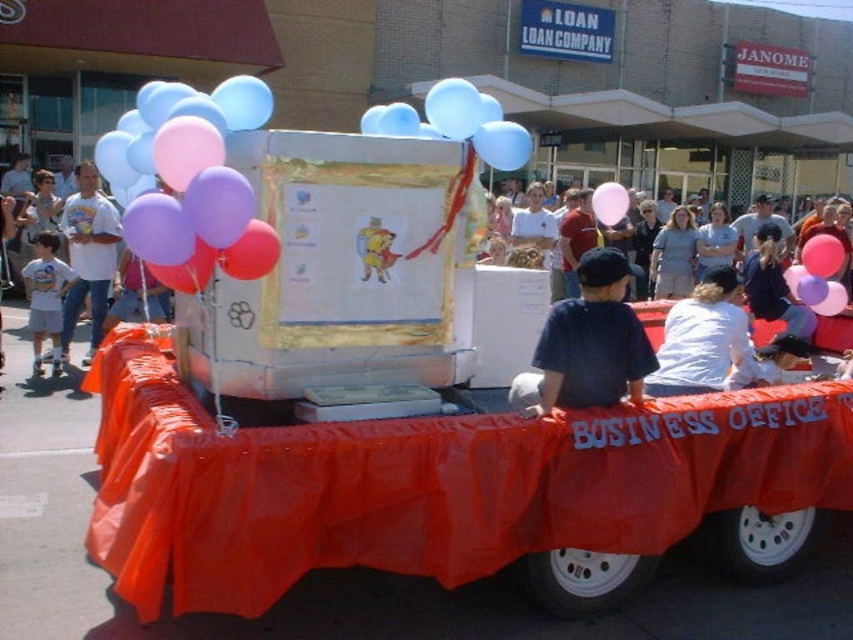
Can you confirm if white cotton shirt at lower center is positioned to the left of light blue latex balloon at upper center?

No, white cotton shirt at lower center is not to the left of light blue latex balloon at upper center.

Can you confirm if white cotton shirt at lower center is positioned above light blue latex balloon at upper center?

No.

Between point (648, 394) and point (509, 132), which one is positioned in front?

Point (509, 132)

The image size is (853, 640). In order to click on white cotton shirt at lower center in this screenshot , I will do `click(704, 340)`.

Is matte balloons at left positioned at the back of light blue latex balloon at upper center?

That is False.

Based on the photo, is matte balloons at left smaller than light blue latex balloon at upper center?

Yes.

Measure the distance between point (189, 205) and camera.

They are 2.95 meters apart.

Identify the location of matte balloons at left. This screenshot has width=853, height=640. (190, 180).

Is white cotton t-shirt at left above pink matte balloon at center?

No.

Who is more forward, (50, 266) or (599, 211)?

Point (599, 211) is more forward.

Find the location of a particular element. white cotton t-shirt at left is located at coordinates (45, 300).